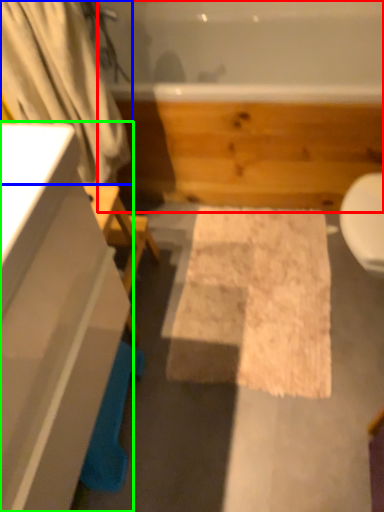
Question: Estimate the real-world distances between objects in this image. Which object is farther from jacuzzi (highlighted by a red box), shower curtain (highlighted by a blue box) or bathroom cabinet (highlighted by a green box)?

Choices:
 (A) shower curtain
 (B) bathroom cabinet

Answer: (B)